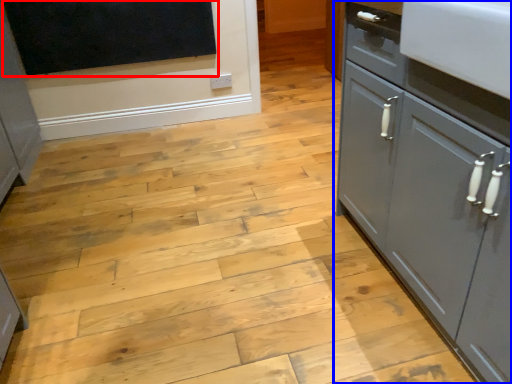
Question: Which object is further to the camera taking this photo, dark (highlighted by a red box) or cupboard (highlighted by a blue box)?

Choices:
 (A) dark
 (B) cupboard

Answer: (A)